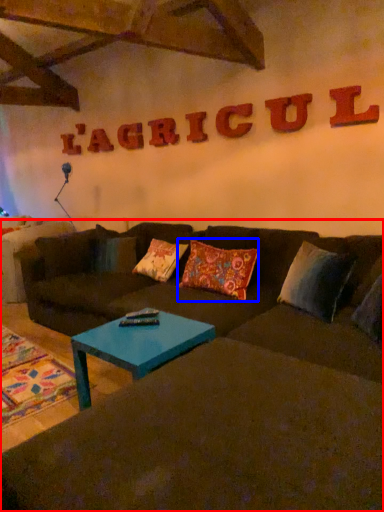
Question: Which of the following is the farthest to the observer, studio couch (highlighted by a red box) or pillow (highlighted by a blue box)?

Choices:
 (A) studio couch
 (B) pillow

Answer: (B)